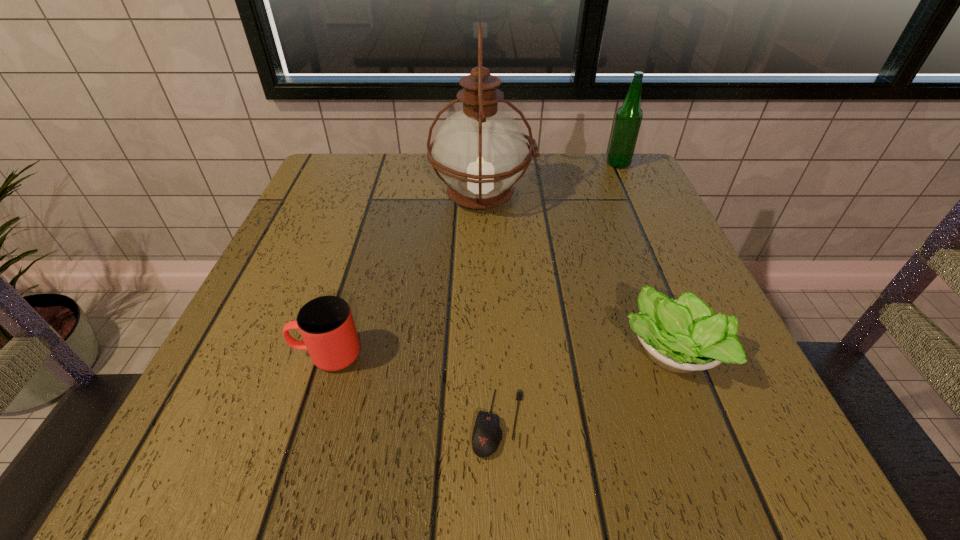
Locate an element on the screen. This screenshot has height=540, width=960. vacant space that's between the mouse and the oil lamp is located at coordinates (491, 310).

Locate an element on the screen. empty location between the second shortest object and the second farthest object is located at coordinates (577, 274).

Image resolution: width=960 pixels, height=540 pixels. Identify the location of empty location between the cup and the shortest object. (413, 389).

Locate an element on the screen. The width and height of the screenshot is (960, 540). free space that is in between the beer bottle and the fourth nearest object is located at coordinates (550, 180).

Identify the location of free spot between the second shortest object and the shortest object. Image resolution: width=960 pixels, height=540 pixels. [x=585, y=388].

The width and height of the screenshot is (960, 540). I want to click on vacant space in between the lettuce and the shortest object, so click(585, 388).

Where is `free area in between the mouse and the leftmost object`? free area in between the mouse and the leftmost object is located at coordinates (413, 389).

At what (x,y) coordinates should I click in order to perform the action: click on unoccupied position between the lettuce and the shortest object. Please return your answer as a coordinate pair (x, y). The height and width of the screenshot is (540, 960). Looking at the image, I should click on (585, 388).

Where is `free spot between the fourth tallest object and the cup`? free spot between the fourth tallest object and the cup is located at coordinates (499, 353).

The image size is (960, 540). In order to click on object that is the fourth closest to the beer bottle in this screenshot , I will do pos(326,324).